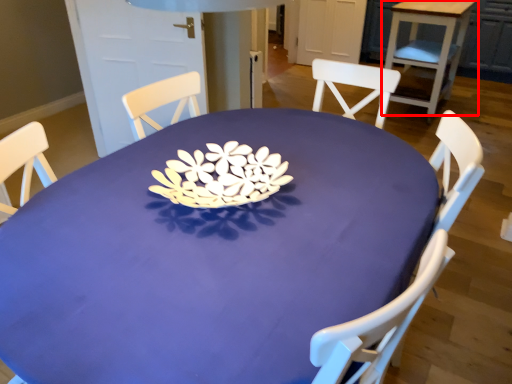
Question: From the image's perspective, what is the correct spatial relationship of table (annotated by the red box) in relation to table?

Choices:
 (A) above
 (B) below

Answer: (A)